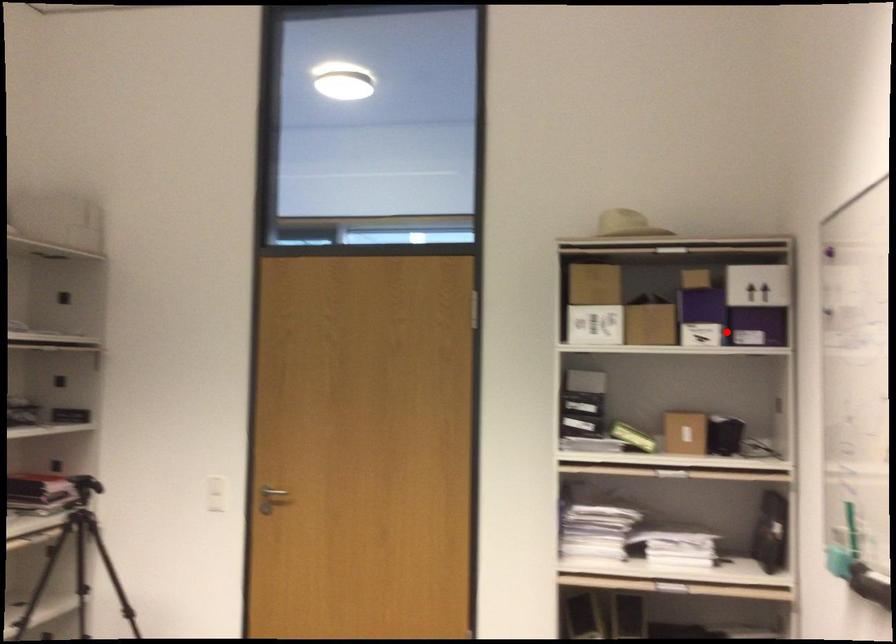
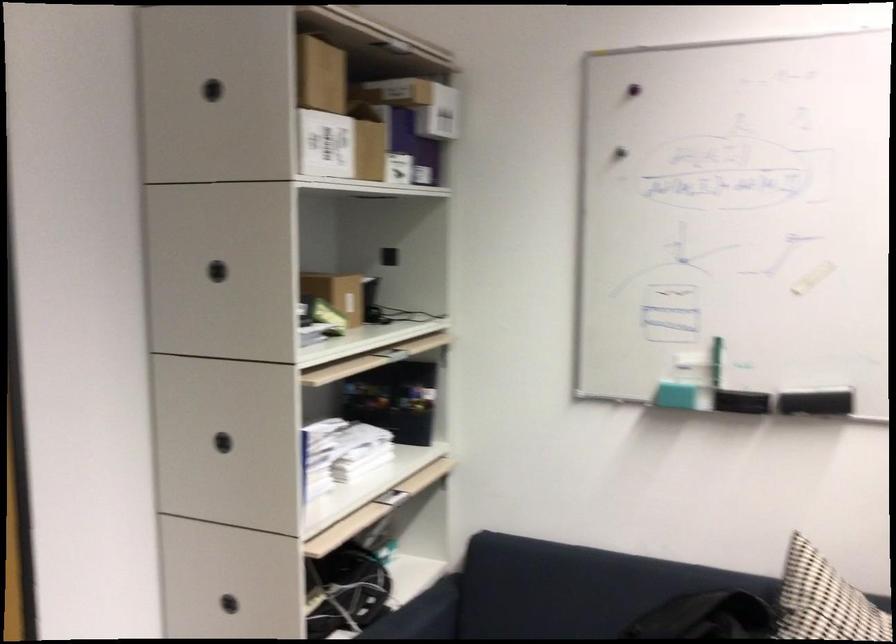
Question: I am providing you with two images of the same scene from different viewpoints. Image1 has a red point marked. In image2, the corresponding 3D location appears at what relative position? Reply with the corresponding letter.

Choices:
 (A) Closer
 (B) Farther

Answer: (A)